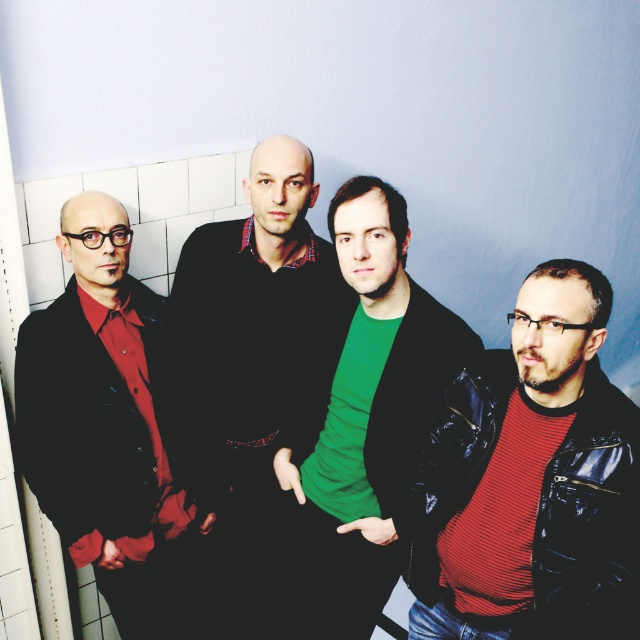
Between red striped sweater at right and matte black jacket at left, which one has more height?

With more height is matte black jacket at left.

Does red striped sweater at right appear under matte black jacket at left?

No, red striped sweater at right is not below matte black jacket at left.

At what (x,y) coordinates should I click in order to perform the action: click on red striped sweater at right. Please return your answer as a coordinate pair (x, y). Image resolution: width=640 pixels, height=640 pixels. Looking at the image, I should click on (531, 481).

Is point (429, 500) closer to camera compared to point (272, 330)?

Yes, point (429, 500) is in front of point (272, 330).

Does red striped sweater at right appear on the left side of matte black sweater at center?

In fact, red striped sweater at right is to the right of matte black sweater at center.

Consider the image. Who is more distant from viewer, [572,435] or [256,444]?

Point [256,444]

At what (x,y) coordinates should I click in order to perform the action: click on red striped sweater at right. Please return your answer as a coordinate pair (x, y). The image size is (640, 640). Looking at the image, I should click on [x=531, y=481].

Does green matte shirt at center have a lesser width compared to matte black sweater at center?

No, green matte shirt at center is not thinner than matte black sweater at center.

Can you confirm if green matte shirt at center is positioned to the left of matte black sweater at center?

In fact, green matte shirt at center is to the right of matte black sweater at center.

Identify the location of green matte shirt at center. (365, 416).